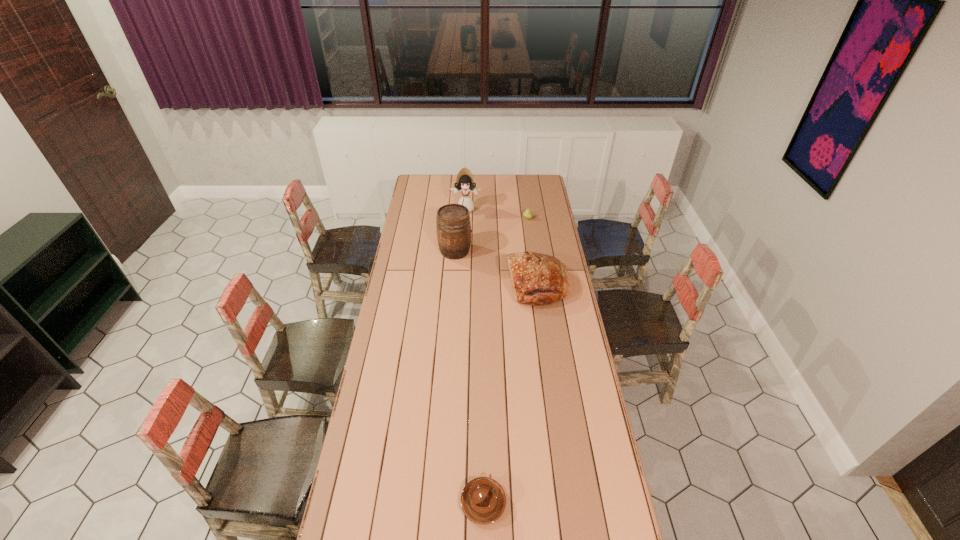
The height and width of the screenshot is (540, 960). I want to click on vacant space located at the sliced front of the third tallest object, so click(462, 286).

Locate an element on the screen. This screenshot has width=960, height=540. vacant region located at the sliced front of the third tallest object is located at coordinates (480, 286).

Locate an element on the screen. This screenshot has width=960, height=540. free location located 0.390m at the sliced front of the third tallest object is located at coordinates (427, 286).

Locate an element on the screen. This screenshot has height=540, width=960. vacant space located 0.140m on the back of the pear is located at coordinates tap(525, 202).

The height and width of the screenshot is (540, 960). What are the coordinates of `vacant space located on the side of the nearest object with the handle` in the screenshot? It's located at (483, 400).

The image size is (960, 540). Find the location of `vacant space located on the side of the nearest object with the handle`. vacant space located on the side of the nearest object with the handle is located at coordinates (483, 417).

Where is `vacant space located 0.130m on the side of the nearest object with the handle`? The image size is (960, 540). vacant space located 0.130m on the side of the nearest object with the handle is located at coordinates tap(483, 442).

At what (x,y) coordinates should I click in order to perform the action: click on bread at the right edge. Please return your answer as a coordinate pair (x, y). The height and width of the screenshot is (540, 960). Looking at the image, I should click on (537, 279).

Where is `pear located at the right edge`? pear located at the right edge is located at coordinates (528, 214).

Identify the location of blank area at the far edge. This screenshot has height=540, width=960. (516, 192).